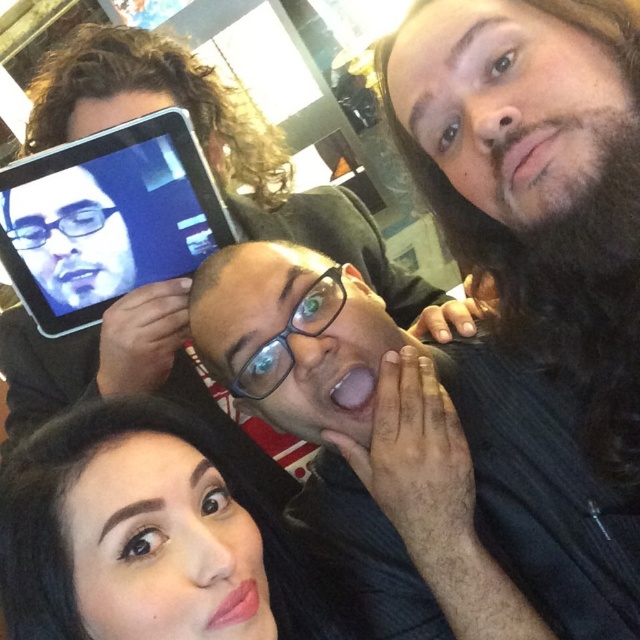
From the picture: You are a photographer trying to capture a closeup of the shiny black hair at lower left and the black plastic tablet at upper left in the scene. Which object should you focus on first if you want to ensure both are in focus without moving the camera?

The shiny black hair at lower left is located below the black plastic tablet at upper left. To ensure both are in focus, focus on the black plastic tablet at upper left first since it is closer to the camera.

You are a photographer trying to capture a closeup shot of the shiny black hair at lower left and the black plastic tablet at upper left. The camera you are using has a minimum focus distance of 18 inches. Will you be able to focus on both objects without moving the camera?

The shiny black hair at lower left and the black plastic tablet at upper left are 17.69 inches apart from each other. Since the minimum focus distance is 18 inches, the camera cannot focus on both objects simultaneously as they are closer than the required distance.

You are a photographer trying to capture a clear shot of the black plastic tablet at upper left. However, the shiny black hair at lower left is blocking your view. Can you adjust your position to see the tablet without moving the objects?

The shiny black hair at lower left is in front of the black plastic tablet at upper left, so moving your position slightly backward or to the side might allow you to see around the hair and view the tablet.